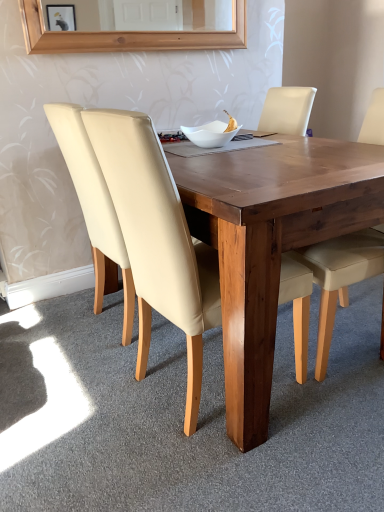
Question: Could you tell me if white glossy bowl at center is facing beige leather chair at left, which appears as the second chair when viewed from the left?

Choices:
 (A) yes
 (B) no

Answer: (A)

Question: Considering the relative sizes of white glossy bowl at center and beige leather chair at left, which appears as the second chair when viewed from the left, in the image provided, is white glossy bowl at center bigger than beige leather chair at left, which appears as the second chair when viewed from the left,?

Choices:
 (A) no
 (B) yes

Answer: (A)

Question: Is beige leather chair at left, which appears as the second chair when viewed from the right, surrounded by white glossy bowl at center?

Choices:
 (A) yes
 (B) no

Answer: (B)

Question: Is white glossy bowl at center positioned beyond the bounds of beige leather chair at left, which appears as the second chair when viewed from the right?

Choices:
 (A) yes
 (B) no

Answer: (A)

Question: Does white glossy bowl at center have a greater width compared to beige leather chair at left, which appears as the second chair when viewed from the right?

Choices:
 (A) yes
 (B) no

Answer: (B)

Question: Is wooden table at center spatially inside white glossy bowl at center, or outside of it?

Choices:
 (A) outside
 (B) inside

Answer: (A)

Question: Relative to white glossy bowl at center, is wooden table at center in front or behind?

Choices:
 (A) behind
 (B) front

Answer: (B)

Question: Based on their sizes in the image, would you say wooden table at center is bigger or smaller than white glossy bowl at center?

Choices:
 (A) small
 (B) big

Answer: (B)

Question: Is wooden table at center wider or thinner than white glossy bowl at center?

Choices:
 (A) wide
 (B) thin

Answer: (A)

Question: From the image's perspective, is beige leather chair at left, the first chair positioned from the left, located above or below beige leather chair at left, which appears as the second chair when viewed from the right?

Choices:
 (A) above
 (B) below

Answer: (A)

Question: From a real-world perspective, is beige leather chair at left, the first chair positioned from the left, physically located above or below beige leather chair at left, which appears as the second chair when viewed from the right?

Choices:
 (A) above
 (B) below

Answer: (A)

Question: Visually, is beige leather chair at left, the first chair positioned from the left, positioned to the left or to the right of beige leather chair at left, which appears as the second chair when viewed from the right?

Choices:
 (A) left
 (B) right

Answer: (A)

Question: Considering the positions of beige leather chair at left, the first chair positioned from the left, and beige leather chair at left, which appears as the second chair when viewed from the right, in the image, is beige leather chair at left, the first chair positioned from the left, bigger or smaller than beige leather chair at left, which appears as the second chair when viewed from the right,?

Choices:
 (A) small
 (B) big

Answer: (A)

Question: Does point (119, 170) appear closer or farther from the camera than point (375, 259)?

Choices:
 (A) closer
 (B) farther

Answer: (A)

Question: Is beige leather chair at left, which appears as the second chair when viewed from the right, taller or shorter than beige leather chair at center, which is the third chair from left to right?

Choices:
 (A) tall
 (B) short

Answer: (A)